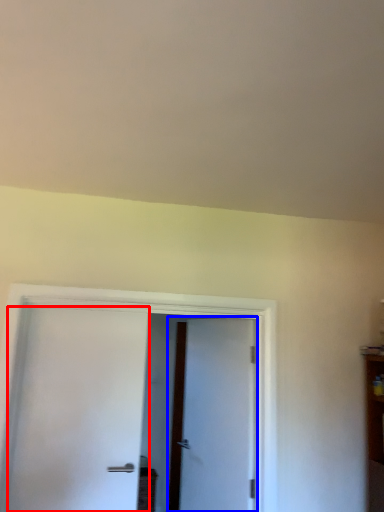
Question: Which point is closer to the camera, door (highlighted by a red box) or door (highlighted by a blue box)?

Choices:
 (A) door
 (B) door

Answer: (A)